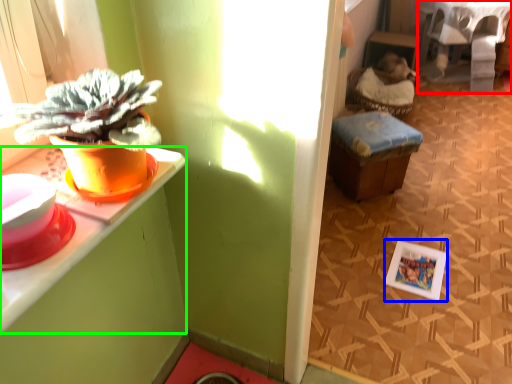
Question: Based on their relative distances, which object is nearer to table (highlighted by a red box)? Choose from picture frame (highlighted by a blue box) and desk (highlighted by a green box).

Choices:
 (A) picture frame
 (B) desk

Answer: (A)